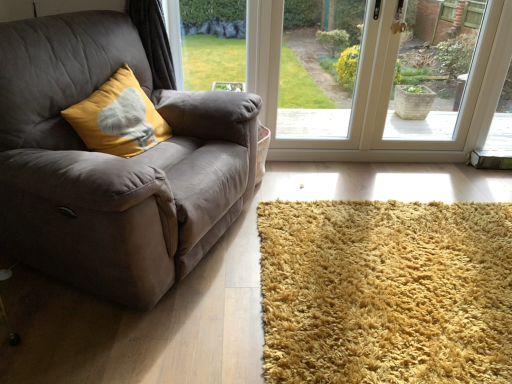
The height and width of the screenshot is (384, 512). Identify the location of shaggy golden rug at lower right. (386, 292).

Identify the location of mustard velvet cushion at left. The height and width of the screenshot is (384, 512). (118, 118).

The width and height of the screenshot is (512, 384). What do you see at coordinates (112, 163) in the screenshot?
I see `suede gray couch at left` at bounding box center [112, 163].

This screenshot has width=512, height=384. Describe the element at coordinates (380, 89) in the screenshot. I see `transparent glass window at center` at that location.

Where is `shaggy golden rug at lower right`? This screenshot has width=512, height=384. shaggy golden rug at lower right is located at coordinates (386, 292).

Would you say shaggy golden rug at lower right is to the left or to the right of transparent glass window at center in the picture?

shaggy golden rug at lower right is to the right of transparent glass window at center.

Considering the sizes of shaggy golden rug at lower right and transparent glass window at center in the image, is shaggy golden rug at lower right taller or shorter than transparent glass window at center?

In the image, shaggy golden rug at lower right appears to be shorter than transparent glass window at center.

Between shaggy golden rug at lower right and transparent glass window at center, which one has smaller width?

With smaller width is transparent glass window at center.

Which is closer, (405,357) or (442,156)?

Point (405,357) is positioned closer to the camera compared to point (442,156).

Which object is thinner, shaggy golden rug at lower right or mustard velvet cushion at left?

mustard velvet cushion at left is thinner.

Which object is positioned more to the right, shaggy golden rug at lower right or mustard velvet cushion at left?

From the viewer's perspective, shaggy golden rug at lower right appears more on the right side.

Does shaggy golden rug at lower right turn towards mustard velvet cushion at left?

No, shaggy golden rug at lower right is not oriented towards mustard velvet cushion at left.

From the image's perspective, is shaggy golden rug at lower right positioned above or below mustard velvet cushion at left?

shaggy golden rug at lower right is below mustard velvet cushion at left.

Which is more to the right, transparent glass door at center, acting as the 2th window screen starting from the right, or mustard velvet cushion at left?

transparent glass door at center, acting as the 2th window screen starting from the right.

Is transparent glass door at center, acting as the 2th window screen starting from the right, in contact with mustard velvet cushion at left?

transparent glass door at center, acting as the 2th window screen starting from the right, and mustard velvet cushion at left are not in contact.

Does transparent glass door at center, acting as the 2th window screen starting from the right, come behind mustard velvet cushion at left?

Yes, transparent glass door at center, acting as the 2th window screen starting from the right, is further from the viewer.

Looking at this image, is suede gray couch at left bigger or smaller than transparent glass door at center, the second window screen positioned from the left?

suede gray couch at left is bigger than transparent glass door at center, the second window screen positioned from the left.

Between suede gray couch at left and transparent glass door at center, acting as the 2th window screen starting from the right, which one has less height?

transparent glass door at center, acting as the 2th window screen starting from the right.

From a real-world perspective, relative to transparent glass door at center, acting as the 2th window screen starting from the right, is suede gray couch at left vertically above or below?

In terms of real-world spatial position, suede gray couch at left is below transparent glass door at center, acting as the 2th window screen starting from the right.

Is suede gray couch at left next to transparent glass door at center, acting as the 2th window screen starting from the right?

There is a gap between suede gray couch at left and transparent glass door at center, acting as the 2th window screen starting from the right.

Locate an element on the screen. The height and width of the screenshot is (384, 512). the 1st window screen to the left when counting from the white textured basket at upper right, the 3th window screen positioned from the left is located at coordinates (316, 67).

Is point (360, 4) closer to viewer compared to point (431, 120)?

No, it is behind (431, 120).

Measure the distance from transparent glass door at center, acting as the 2th window screen starting from the right, to white textured basket at upper right, the 1th window screen when ordered from right to left.

1.13 meters.

Can you tell me how much mustard velvet cushion at left and white textured basket at upper right, the 3th window screen positioned from the left, differ in facing direction?

The angle between the facing direction of mustard velvet cushion at left and the facing direction of white textured basket at upper right, the 3th window screen positioned from the left, is 64 degrees.

In the scene shown: Can you confirm if mustard velvet cushion at left is thinner than white textured basket at upper right, the 1th window screen when ordered from right to left?

In fact, mustard velvet cushion at left might be wider than white textured basket at upper right, the 1th window screen when ordered from right to left.

Is mustard velvet cushion at left aimed at white textured basket at upper right, the 1th window screen when ordered from right to left?

No, mustard velvet cushion at left is not facing towards white textured basket at upper right, the 1th window screen when ordered from right to left.

Which is in front, point (95, 147) or point (456, 92)?

Point (95, 147)

Is transparent glass window at center looking in the opposite direction of mustard velvet cushion at left?

transparent glass window at center is not turned away from mustard velvet cushion at left.

The height and width of the screenshot is (384, 512). In order to click on window above the mustard velvet cushion at left (from the image's perspective) in this screenshot , I will do `click(380, 89)`.

From the image's perspective, is transparent glass window at center on mustard velvet cushion at left?

Yes, from the image's perspective, transparent glass window at center is on top of mustard velvet cushion at left.

You are a GUI agent. You are given a task and a screenshot of the screen. Output one action in this format:
    pyautogui.click(x=<x>, y=<y>)
    Task: Click on the window above the shaggy golden rug at lower right (from the image's perspective)
    The width and height of the screenshot is (512, 384).
    Given the screenshot: What is the action you would take?
    pyautogui.click(x=380, y=89)

Find the location of a particular element. The height and width of the screenshot is (384, 512). throw pillow above the shaggy golden rug at lower right (from a real-world perspective) is located at coordinates (118, 118).

Based on their spatial positions, is white textured basket at upper right, the 3th window screen positioned from the left, or transparent glass window at center closer to transparent glass door at center, acting as the 2th window screen starting from the right?

Based on the image, white textured basket at upper right, the 3th window screen positioned from the left, appears to be nearer to transparent glass door at center, acting as the 2th window screen starting from the right.

Consider the image. Based on their spatial positions, is suede gray couch at left or transparent glass door at center, acting as the 2th window screen starting from the right, closer to green grass at upper center, the 3th window screen from the right?

transparent glass door at center, acting as the 2th window screen starting from the right, lies closer to green grass at upper center, the 3th window screen from the right, than the other object.

Consider the image. Which object lies nearer to the anchor point white textured basket at upper right, the 3th window screen positioned from the left, transparent glass window at center or transparent glass door at center, the second window screen positioned from the left?

Based on the image, transparent glass window at center appears to be nearer to white textured basket at upper right, the 3th window screen positioned from the left.

Which object lies nearer to the anchor point white textured basket at upper right, the 3th window screen positioned from the left, green grass at upper center, the 3th window screen from the right, or suede gray couch at left?

Based on the image, suede gray couch at left appears to be nearer to white textured basket at upper right, the 3th window screen positioned from the left.

Which object lies further to the anchor point green grass at upper center, the 3th window screen from the right, transparent glass window at center or transparent glass door at center, acting as the 2th window screen starting from the right?

transparent glass window at center is positioned further to the anchor green grass at upper center, the 3th window screen from the right.

Based on their spatial positions, is white textured basket at upper right, the 1th window screen when ordered from right to left, or transparent glass door at center, the second window screen positioned from the left, further from shaggy golden rug at lower right?

Based on the image, transparent glass door at center, the second window screen positioned from the left, appears to be further to shaggy golden rug at lower right.

Considering their positions, is shaggy golden rug at lower right positioned further to white textured basket at upper right, the 3th window screen positioned from the left, than transparent glass window at center?

Based on the image, shaggy golden rug at lower right appears to be further to white textured basket at upper right, the 3th window screen positioned from the left.

Considering their positions, is transparent glass window at center positioned further to suede gray couch at left than white textured basket at upper right, the 3th window screen positioned from the left?

white textured basket at upper right, the 3th window screen positioned from the left.

Where is `throw pillow between suede gray couch at left and green grass at upper center, the 1th window screen in the left-to-right sequence, from front to back`? Image resolution: width=512 pixels, height=384 pixels. throw pillow between suede gray couch at left and green grass at upper center, the 1th window screen in the left-to-right sequence, from front to back is located at coordinates (118, 118).

The height and width of the screenshot is (384, 512). I want to click on window situated between transparent glass door at center, the second window screen positioned from the left, and white textured basket at upper right, the 1th window screen when ordered from right to left, from left to right, so click(x=380, y=89).

The image size is (512, 384). I want to click on throw pillow between suede gray couch at left and transparent glass door at center, acting as the 2th window screen starting from the right, along the z-axis, so click(118, 118).

Find the location of a particular element. The image size is (512, 384). window between suede gray couch at left and transparent glass door at center, the second window screen positioned from the left, along the z-axis is located at coordinates (380, 89).